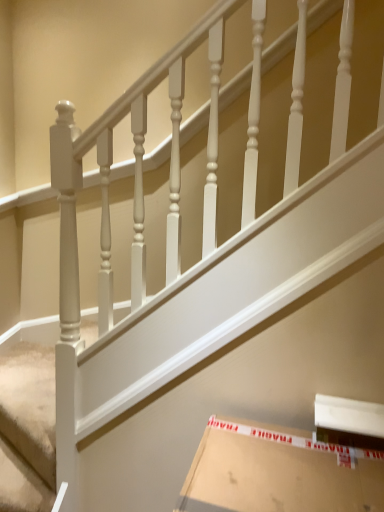
Question: Considering the positions of white cardboard box at lower right and white textured carpet at lower left in the image, is white cardboard box at lower right wider or thinner than white textured carpet at lower left?

Choices:
 (A) thin
 (B) wide

Answer: (B)

Question: Is white cardboard box at lower right inside or outside of white textured carpet at lower left?

Choices:
 (A) outside
 (B) inside

Answer: (A)

Question: In terms of height, does white cardboard box at lower right look taller or shorter compared to white textured carpet at lower left?

Choices:
 (A) tall
 (B) short

Answer: (A)

Question: In terms of width, does white textured carpet at lower left look wider or thinner when compared to white cardboard box at lower right?

Choices:
 (A) thin
 (B) wide

Answer: (A)

Question: Is white textured carpet at lower left taller or shorter than white cardboard box at lower right?

Choices:
 (A) tall
 (B) short

Answer: (B)

Question: Considering the positions of point (41, 397) and point (329, 475), is point (41, 397) closer or farther from the camera than point (329, 475)?

Choices:
 (A) closer
 (B) farther

Answer: (B)

Question: From a real-world perspective, is white textured carpet at lower left physically located above or below white cardboard box at lower right?

Choices:
 (A) above
 (B) below

Answer: (B)